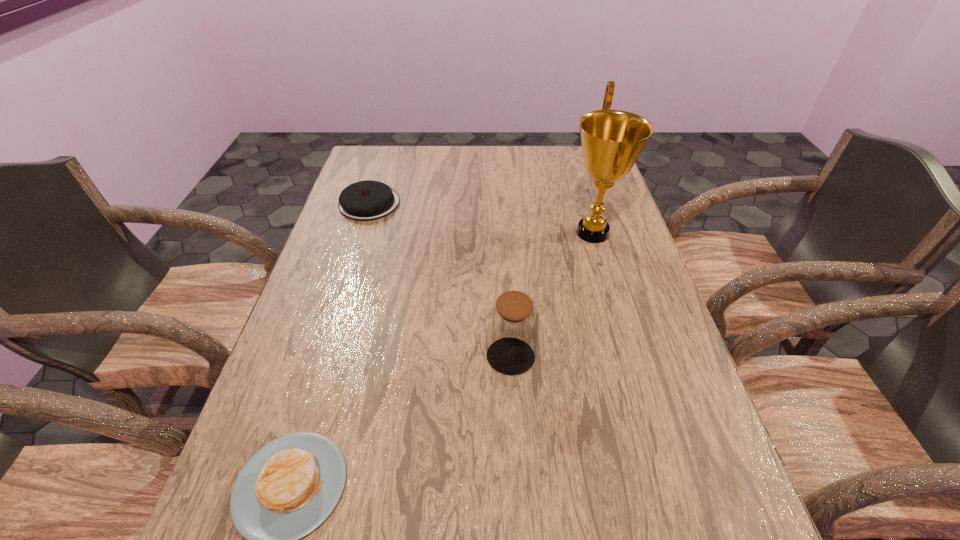
Find the location of `object positioned at the left edge`. object positioned at the left edge is located at coordinates (367, 200).

Find the location of a particular element. The image size is (960, 540). object that is at the right edge is located at coordinates (612, 140).

At what (x,y) coordinates should I click in order to perform the action: click on vacant space at the far edge. Please return your answer as a coordinate pair (x, y). The width and height of the screenshot is (960, 540). Looking at the image, I should click on (416, 156).

The image size is (960, 540). I want to click on vacant area at the left edge, so click(326, 293).

The height and width of the screenshot is (540, 960). In order to click on free space at the right edge in this screenshot , I will do `click(621, 215)`.

In the image, there is a desktop. Where is `vacant region at the far left corner`? vacant region at the far left corner is located at coordinates (358, 180).

You are a GUI agent. You are given a task and a screenshot of the screen. Output one action in this format:
    pyautogui.click(x=<x>, y=<y>)
    Task: Click on the free spot between the third farthest object and the rightmost object
    The height and width of the screenshot is (540, 960).
    Given the screenshot: What is the action you would take?
    pyautogui.click(x=552, y=295)

The image size is (960, 540). What are the coordinates of `free area in between the rightmost object and the farther pancake` in the screenshot? It's located at (481, 218).

Find the location of `vacant area that lies between the award and the farther pancake`. vacant area that lies between the award and the farther pancake is located at coordinates (481, 218).

At what (x,y) coordinates should I click in order to perform the action: click on vacant space that's between the farther pancake and the second nearest object. Please return your answer as a coordinate pair (x, y). Looking at the image, I should click on (440, 280).